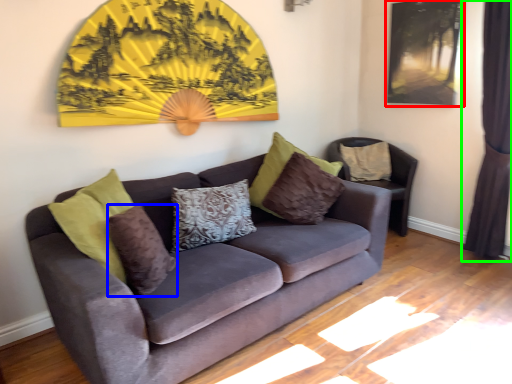
Question: Which is nearer to the picture frame (highlighted by a red box)? pillow (highlighted by a blue box) or curtain (highlighted by a green box).

Choices:
 (A) pillow
 (B) curtain

Answer: (B)